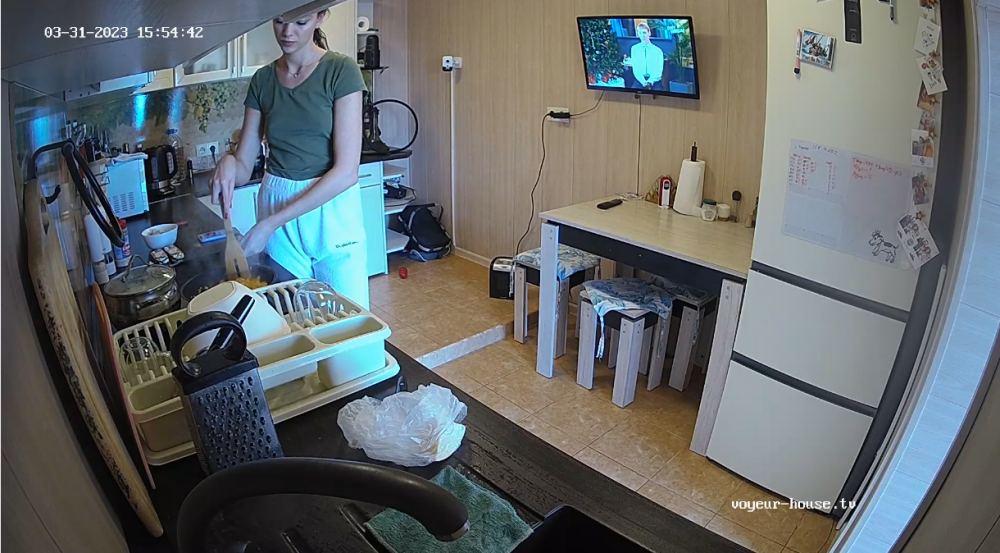
The image size is (1000, 553). Identify the location of plastic dish rack. (319, 323), (297, 400).